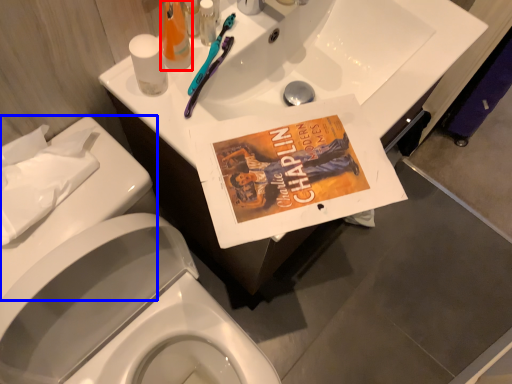
Question: Which object is closer to the camera taking this photo, mouthwash (highlighted by a red box) or porcelain (highlighted by a blue box)?

Choices:
 (A) mouthwash
 (B) porcelain

Answer: (B)